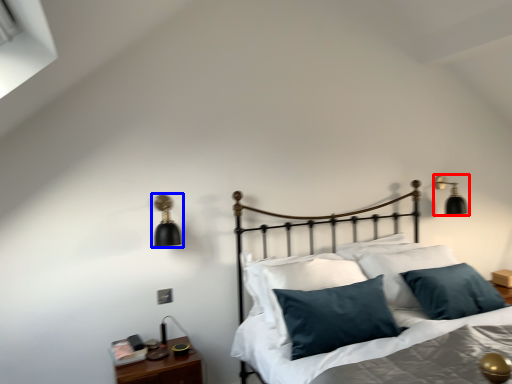
Question: Which object is closer to the camera taking this photo, lamp (highlighted by a red box) or lamp (highlighted by a blue box)?

Choices:
 (A) lamp
 (B) lamp

Answer: (B)